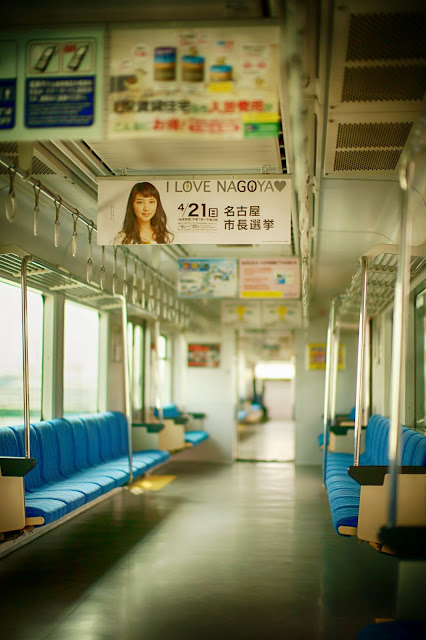
Locate an element on the screen. Image resolution: width=426 pixels, height=640 pixels. door is located at coordinates (134, 365).